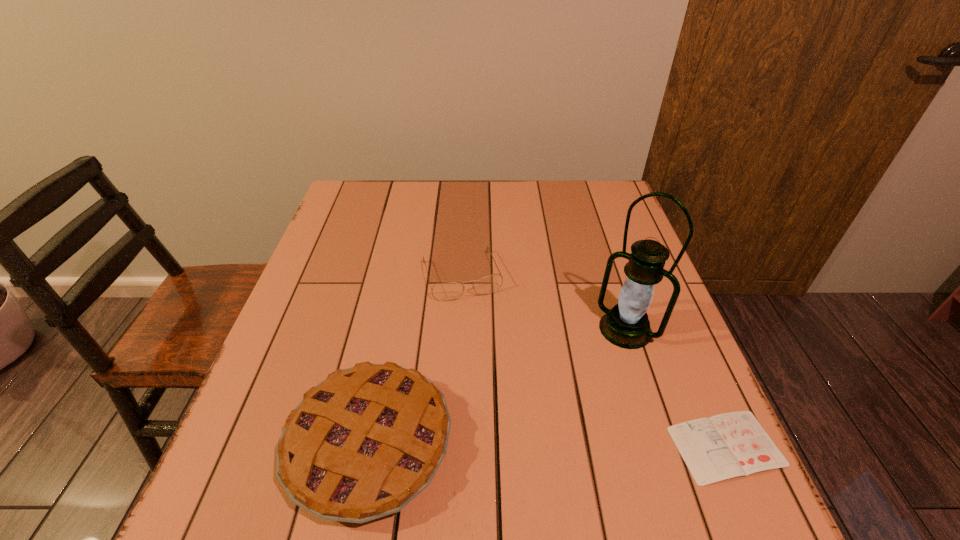
Where is `pie`? pie is located at coordinates pos(362,444).

You are a GUI agent. You are given a task and a screenshot of the screen. Output one action in this format:
    pyautogui.click(x=<x>, y=<y>)
    Task: Click on the shortest object
    The width and height of the screenshot is (960, 540).
    Given the screenshot: What is the action you would take?
    pyautogui.click(x=729, y=445)

This screenshot has width=960, height=540. What are the coordinates of `lantern` in the screenshot? It's located at (626, 325).

Locate an element on the screen. the tallest object is located at coordinates (626, 325).

Identify the location of spectacles. (442, 291).

The width and height of the screenshot is (960, 540). In order to click on the third tallest object in this screenshot , I will do `click(442, 291)`.

At what (x,y) coordinates should I click in order to perform the action: click on free location located on the back of the second tallest object. Please return your answer as a coordinate pair (x, y). Looking at the image, I should click on (407, 253).

I want to click on blank space located 0.050m on the back of the diary, so click(x=701, y=389).

Where is `vacant region located 0.170m on the side where the lantern emits light`? vacant region located 0.170m on the side where the lantern emits light is located at coordinates (570, 395).

The height and width of the screenshot is (540, 960). In order to click on vacant area situated 0.260m on the side where the lantern emits light in this screenshot , I will do `click(543, 426)`.